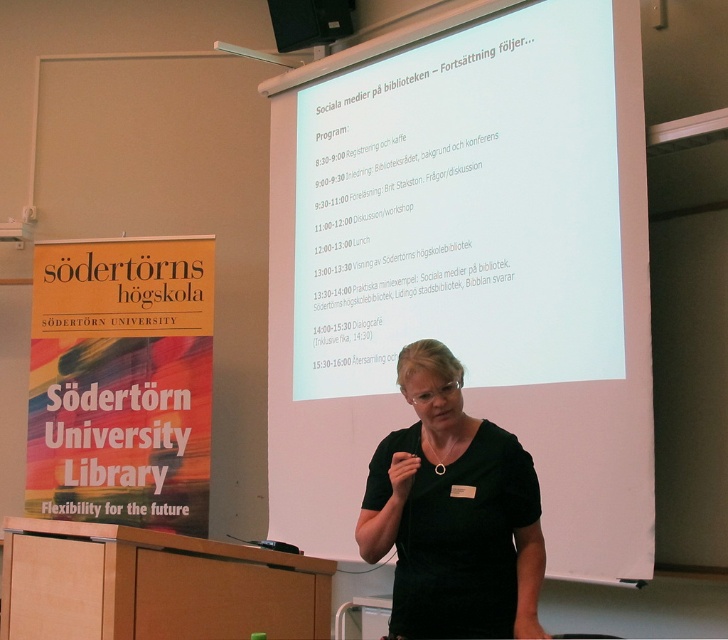
Who is shorter, white matte projection screen at center or black matte dress at center?

Standing shorter between the two is black matte dress at center.

Is white matte projection screen at center above black matte dress at center?

Yes.

Does point (352, 220) lie behind point (379, 497)?

Yes, point (352, 220) is farther from viewer.

At what (x,y) coordinates should I click in order to perform the action: click on white matte projection screen at center. Please return your answer as a coordinate pair (x, y). Looking at the image, I should click on (467, 264).